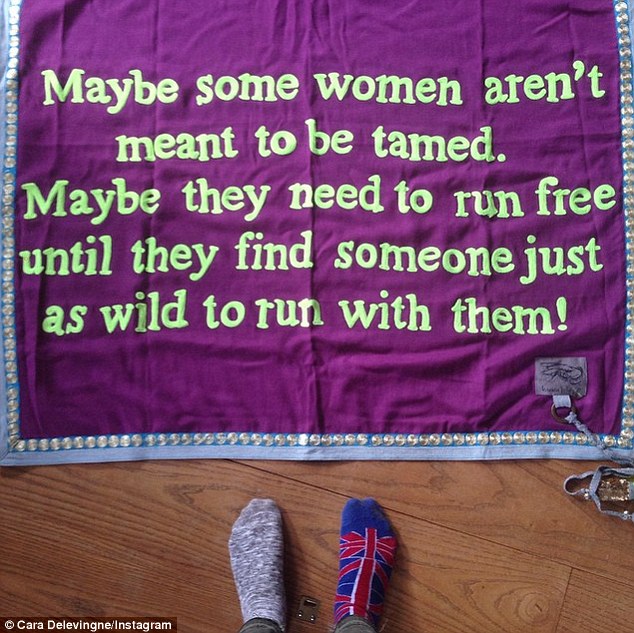
The image size is (634, 633). What are the coordinates of `blue sock` in the screenshot? It's located at (363, 523).